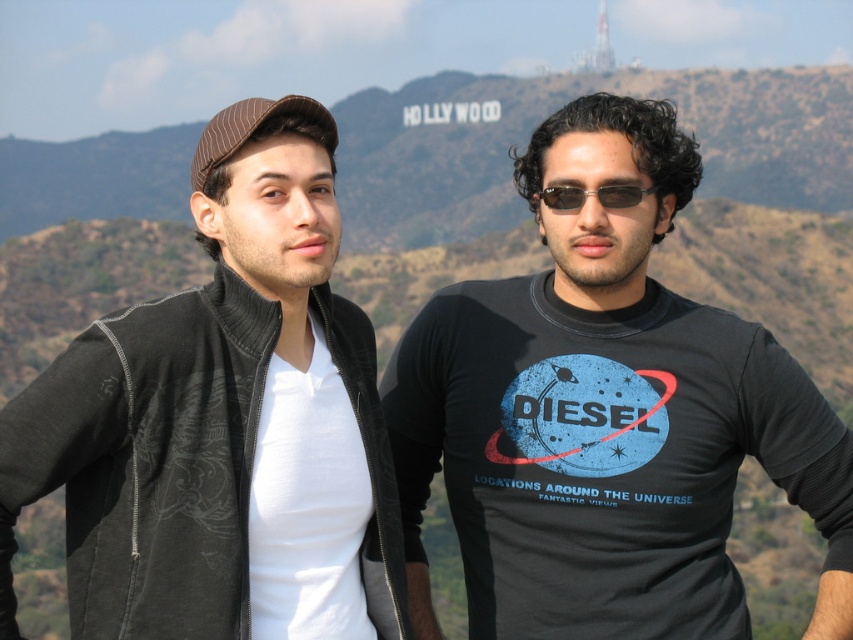
You are standing at the camera position and want to reach the point marked as point (827, 417). If you walk straight ahead, will you reach that point?

Yes, because the point (827, 417) is directly in front of the camera position at a distance of 227.10 feet.

You are standing at the position of the sunglasses at center and want to reach the brownmaterialmountain at upper center. Given that your average walking speed is 5 km per hour, how long would it take you to reach the mountain?

The brownmaterialmountain at upper center is 295.28 meters away from sunglasses at center. At a walking speed of 5 km per hour, it would take approximately 3.5 minutes to reach the mountain.